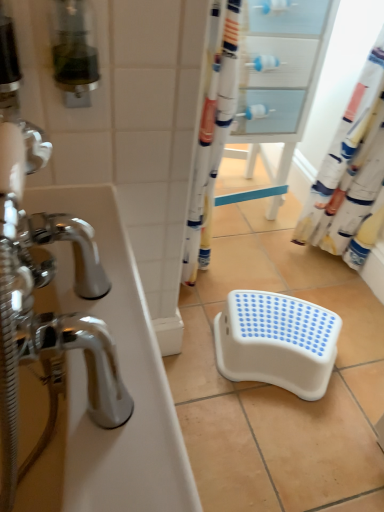
Identify the location of free location in front of white fabric shower curtain at right. click(336, 286).